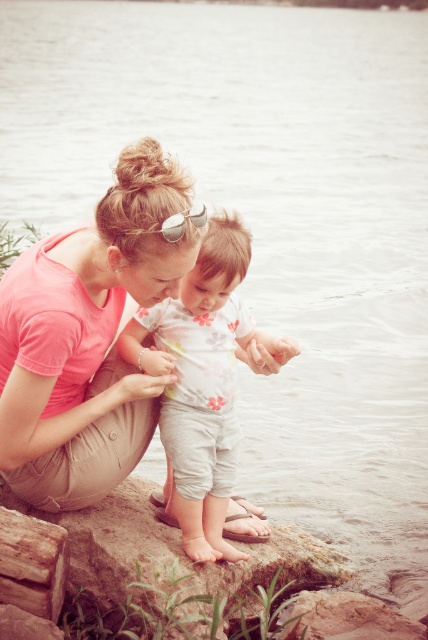
You are standing at the edge of the water and want to hand a small toy to the person wearing the pink matte shirt at center. If the toy has a throwing range of 3 meters, will you be able to reach them?

The pink matte shirt at center is exactly 3.04 meters away from the viewer. Since the throwing range is 3 meters, you are slightly out of range and cannot reach them.

You are standing at point (202,218) and want to walk to the water. Is there a clear path from your current position to the water without passing through point (134,296)?

Since point (134,296) is behind point (202,218), you can walk towards the water from your current position at point (202,218) without needing to go through point (134,296). The path should be clear.